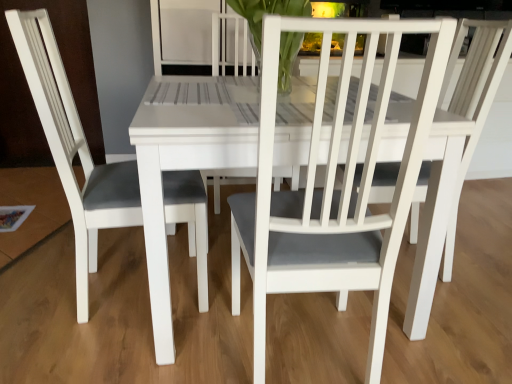
Question: From a real-world perspective, is white matte chair at left, placed as the 1th chair when sorted from left to right, positioned over white matte chair at center, which ranks as the second chair in left-to-right order, based on gravity?

Choices:
 (A) no
 (B) yes

Answer: (B)

Question: Is white matte chair at left, placed as the 1th chair when sorted from left to right, oriented towards white matte chair at center, which is the first chair from right to left?

Choices:
 (A) yes
 (B) no

Answer: (A)

Question: Is white matte chair at left, placed as the 1th chair when sorted from left to right, directly adjacent to white matte chair at center, which is the first chair from right to left?

Choices:
 (A) no
 (B) yes

Answer: (A)

Question: Considering the relative positions of white matte chair at left, the second chair positioned from the right, and white matte chair at center, which is the first chair from right to left, in the image provided, is white matte chair at left, the second chair positioned from the right, to the right of white matte chair at center, which is the first chair from right to left, from the viewer's perspective?

Choices:
 (A) no
 (B) yes

Answer: (A)

Question: Is white matte chair at left, placed as the 1th chair when sorted from left to right, smaller than white matte chair at center, which is the first chair from right to left?

Choices:
 (A) no
 (B) yes

Answer: (B)

Question: From their relative heights in the image, would you say clear glass vase at center is taller or shorter than white matte chair at center, which ranks as the second chair in left-to-right order?

Choices:
 (A) short
 (B) tall

Answer: (A)

Question: In terms of size, does clear glass vase at center appear bigger or smaller than white matte chair at center, which ranks as the second chair in left-to-right order?

Choices:
 (A) big
 (B) small

Answer: (B)

Question: From the image's perspective, relative to white matte chair at center, which is the first chair from right to left, is clear glass vase at center above or below?

Choices:
 (A) above
 (B) below

Answer: (A)

Question: Is clear glass vase at center spatially inside white matte chair at center, which ranks as the second chair in left-to-right order, or outside of it?

Choices:
 (A) inside
 (B) outside

Answer: (B)

Question: In the image, is white matte chair at center, which is the first chair from right to left, on the left side or the right side of white matte chair at left, placed as the 1th chair when sorted from left to right?

Choices:
 (A) right
 (B) left

Answer: (A)

Question: Considering the positions of point (333, 249) and point (183, 208), is point (333, 249) closer or farther from the camera than point (183, 208)?

Choices:
 (A) farther
 (B) closer

Answer: (B)

Question: From the image's perspective, is white matte chair at center, which is the first chair from right to left, positioned above or below white matte chair at left, placed as the 1th chair when sorted from left to right?

Choices:
 (A) above
 (B) below

Answer: (B)

Question: Choose the correct answer: Is white matte chair at center, which is the first chair from right to left, inside white matte chair at left, placed as the 1th chair when sorted from left to right, or outside it?

Choices:
 (A) outside
 (B) inside

Answer: (A)

Question: Do you think white matte chair at center, which is the first chair from right to left, is within clear glass vase at center, or outside of it?

Choices:
 (A) inside
 (B) outside

Answer: (B)

Question: Considering the positions of white matte chair at center, which is the first chair from right to left, and clear glass vase at center in the image, is white matte chair at center, which is the first chair from right to left, wider or thinner than clear glass vase at center?

Choices:
 (A) thin
 (B) wide

Answer: (B)